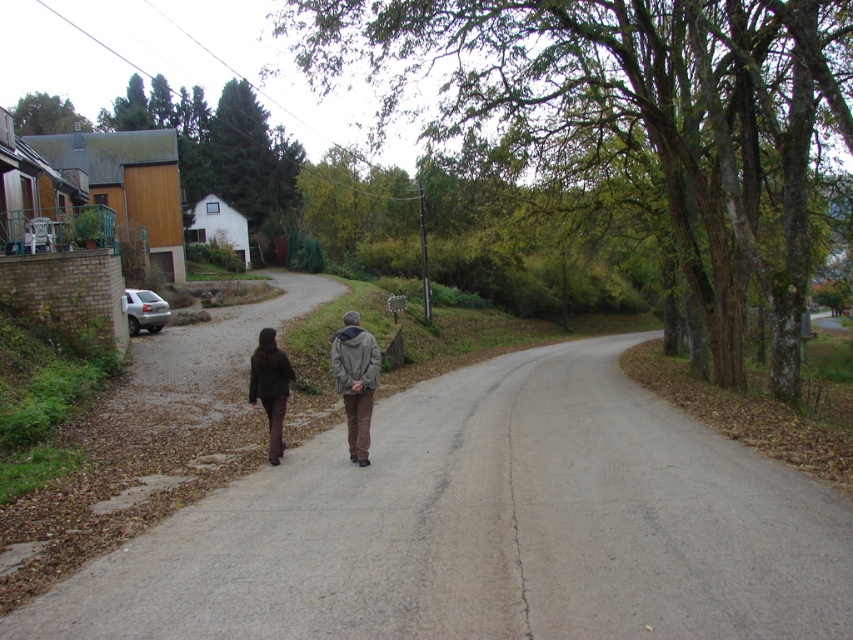
You are a fashion designer observing two jackets in the scene. The brown leather jacket at center and the gray woolen jacket at center. Which one has a larger size?

The brown leather jacket at center has a larger size compared to the gray woolen jacket at center.